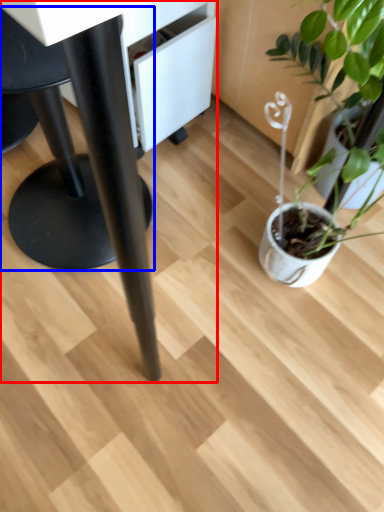
Question: Which object appears closest to the camera in this image, table (highlighted by a red box) or swivel chair (highlighted by a blue box)?

Choices:
 (A) table
 (B) swivel chair

Answer: (A)